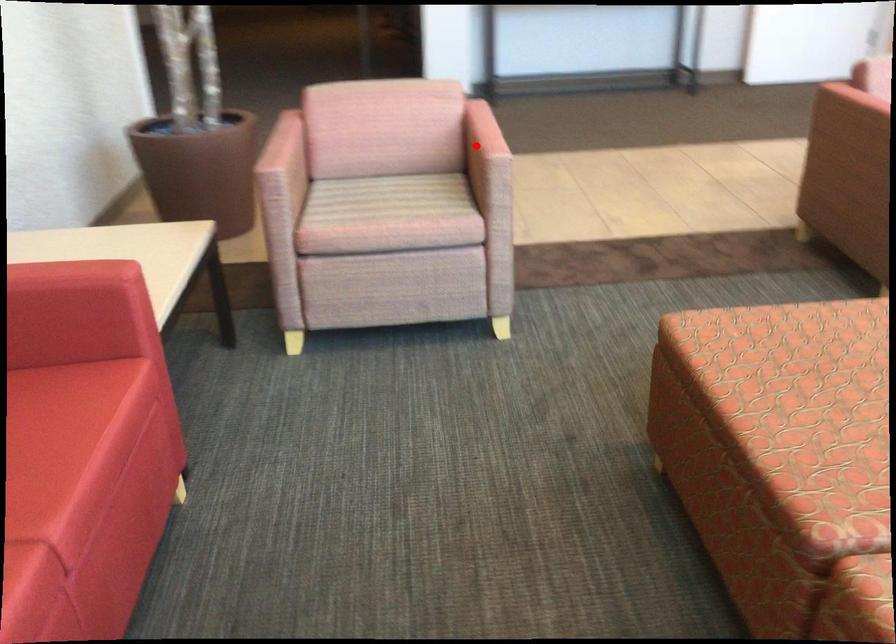
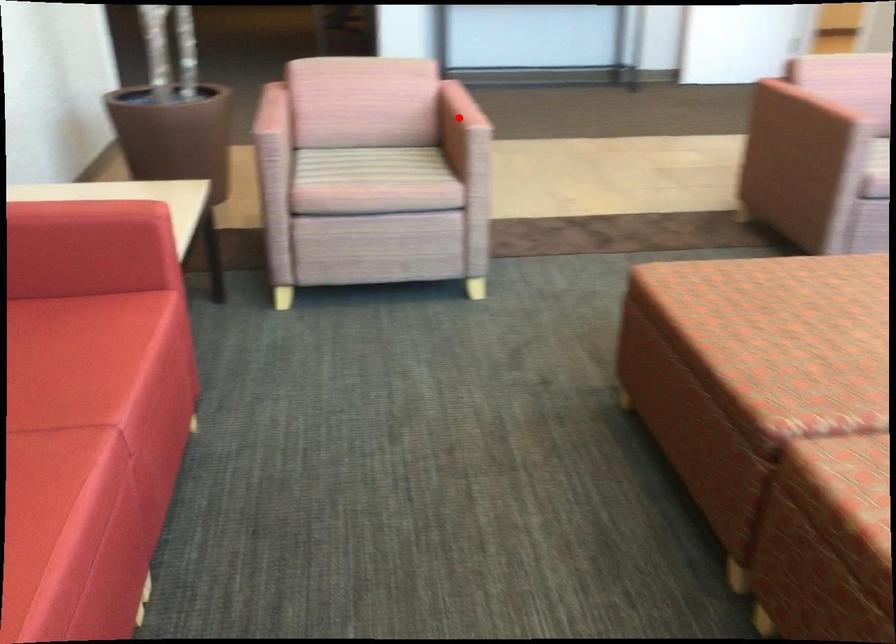
I am providing you with two images of the same scene from different viewpoints. A red point is marked on the first image and another point is marked on the second image. Is the red point in image1 aligned with the point shown in image2?

Yes